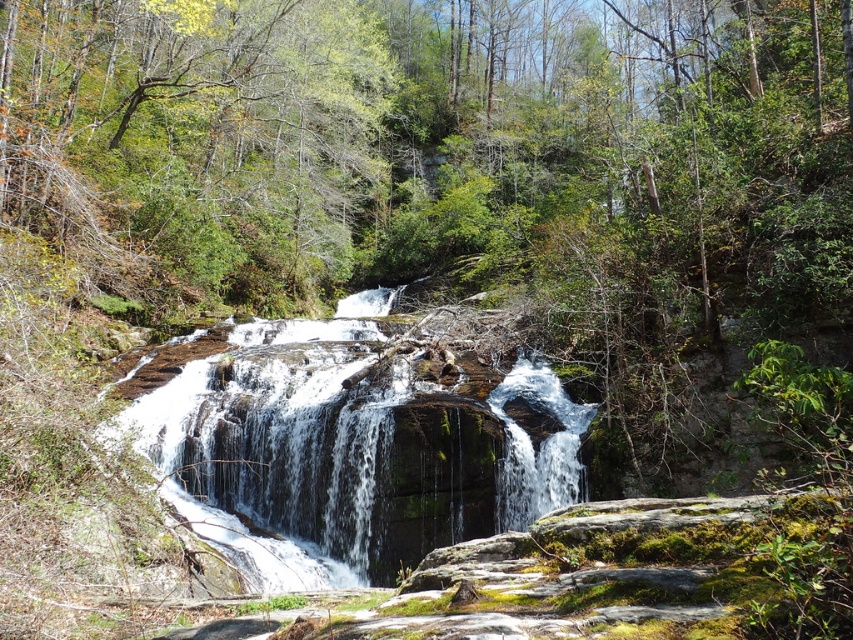
Question: Can you confirm if green leafy tree at upper left is smaller than green mossy rock at center?

Choices:
 (A) yes
 (B) no

Answer: (B)

Question: Which object appears closest to the camera in this image?

Choices:
 (A) green leafy tree at upper left
 (B) green mossy rock at center

Answer: (B)

Question: Which point is closer to the camera taking this photo?

Choices:
 (A) (314, 145)
 (B) (390, 572)

Answer: (B)

Question: Can you confirm if green leafy tree at upper left is wider than green mossy rock at center?

Choices:
 (A) yes
 (B) no

Answer: (B)

Question: Is green leafy tree at upper left closer to camera compared to green mossy rock at center?

Choices:
 (A) yes
 (B) no

Answer: (B)

Question: Which point is farther from the camera taking this photo?

Choices:
 (A) (136, 61)
 (B) (250, 376)

Answer: (A)